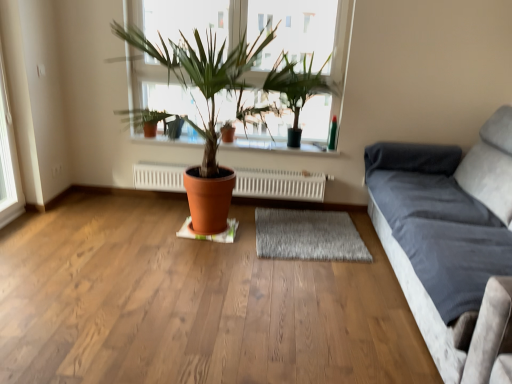
Question: From the image's perspective, is white radiator at center under terracotta pot at center?

Choices:
 (A) yes
 (B) no

Answer: (A)

Question: Is white radiator at center positioned before terracotta pot at center?

Choices:
 (A) no
 (B) yes

Answer: (B)

Question: Is white radiator at center positioned with its back to terracotta pot at center?

Choices:
 (A) no
 (B) yes

Answer: (A)

Question: Is white radiator at center wider than terracotta pot at center?

Choices:
 (A) yes
 (B) no

Answer: (A)

Question: Does white radiator at center have a greater height compared to terracotta pot at center?

Choices:
 (A) yes
 (B) no

Answer: (A)

Question: In terms of width, does gray shaggy rug at center look wider or thinner when compared to white radiator at center?

Choices:
 (A) wide
 (B) thin

Answer: (A)

Question: Considering the positions of gray shaggy rug at center and white radiator at center in the image, is gray shaggy rug at center taller or shorter than white radiator at center?

Choices:
 (A) tall
 (B) short

Answer: (B)

Question: In the image, is gray shaggy rug at center on the left side or the right side of white radiator at center?

Choices:
 (A) right
 (B) left

Answer: (A)

Question: Relative to white radiator at center, is gray shaggy rug at center in front or behind?

Choices:
 (A) behind
 (B) front

Answer: (B)

Question: Based on their positions, is matte glass window at center located to the left or right of white plastic window frame at left?

Choices:
 (A) right
 (B) left

Answer: (A)

Question: From a real-world perspective, is matte glass window at center positioned above or below white plastic window frame at left?

Choices:
 (A) below
 (B) above

Answer: (B)

Question: Considering the positions of matte glass window at center and white plastic window frame at left in the image, is matte glass window at center bigger or smaller than white plastic window frame at left?

Choices:
 (A) big
 (B) small

Answer: (A)

Question: Is matte glass window at center in front of or behind white plastic window frame at left in the image?

Choices:
 (A) front
 (B) behind

Answer: (B)

Question: Is point (224, 130) positioned closer to the camera than point (15, 208)?

Choices:
 (A) closer
 (B) farther

Answer: (A)

Question: Considering the positions of terracotta clay pot at center and white plastic window frame at left in the image, is terracotta clay pot at center taller or shorter than white plastic window frame at left?

Choices:
 (A) tall
 (B) short

Answer: (B)